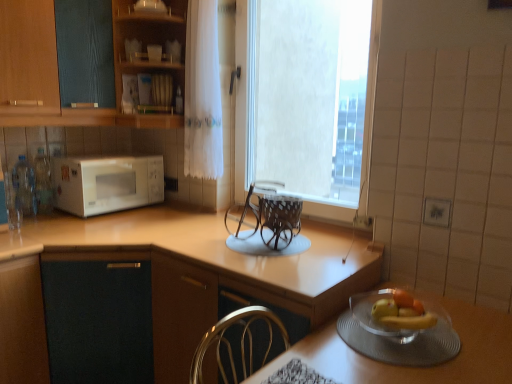
Identify the location of free space above light brown laminate countertop at left (from a real-world perspective). The height and width of the screenshot is (384, 512). (110, 223).